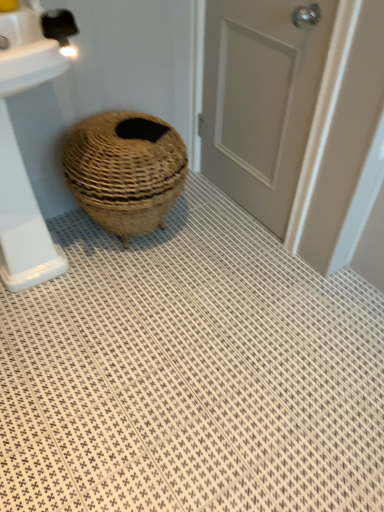
Question: Considering the positions of white glossy sink at left and white textured bath mat at center in the image, is white glossy sink at left taller or shorter than white textured bath mat at center?

Choices:
 (A) tall
 (B) short

Answer: (A)

Question: Looking at their shapes, would you say white glossy sink at left is wider or thinner than white textured bath mat at center?

Choices:
 (A) wide
 (B) thin

Answer: (B)

Question: Which of these objects is positioned closest to the natural woven basket at center?

Choices:
 (A) white glossy sink at left
 (B) white textured bath mat at center
 (C) matte gray door at center

Answer: (A)

Question: Which of these objects is positioned farthest from the white glossy sink at left?

Choices:
 (A) white textured bath mat at center
 (B) natural woven basket at center
 (C) matte gray door at center

Answer: (C)